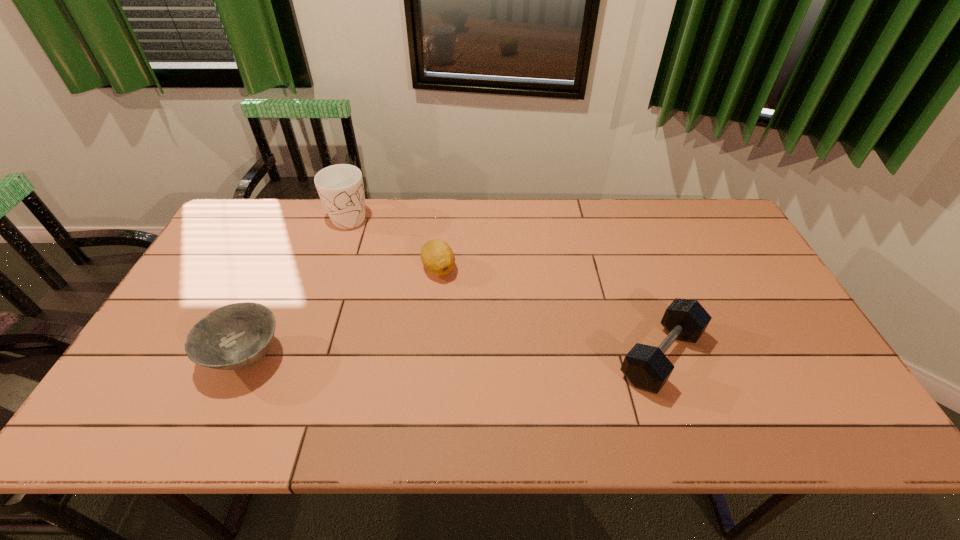
At what (x,y) coordinates should I click in order to perform the action: click on free space on the desktop that is between the bowl and the rightmost object and is positioned at the stem end of the lemon. Please return your answer as a coordinate pair (x, y). Image resolution: width=960 pixels, height=540 pixels. Looking at the image, I should click on (437, 356).

Identify the location of vacant space on the desktop that is between the bowl and the rightmost object and is positioned on the side of the farthest object with the handle. Image resolution: width=960 pixels, height=540 pixels. (410, 356).